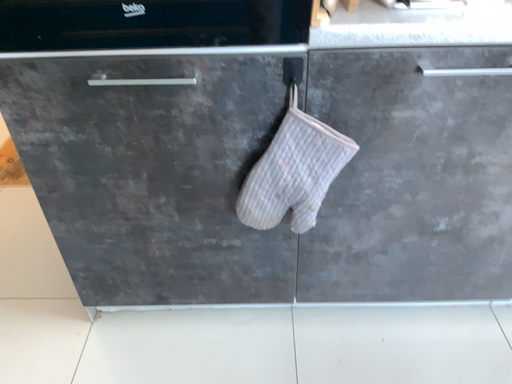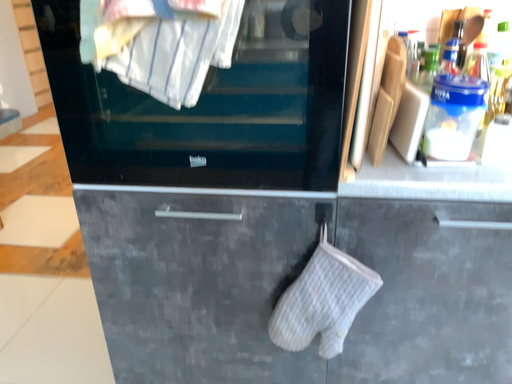
Question: How did the camera likely rotate when shooting the video?

Choices:
 (A) rotated upward
 (B) rotated downward

Answer: (A)